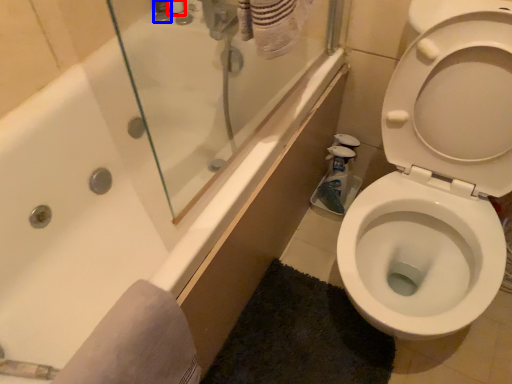
Question: Among these objects, which one is nearest to the camera, toiletry (highlighted by a red box) or toiletry (highlighted by a blue box)?

Choices:
 (A) toiletry
 (B) toiletry

Answer: (B)